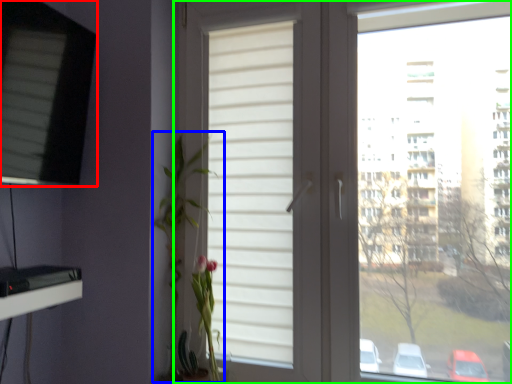
Question: Estimate the real-world distances between objects in this image. Which object is closer to window (highlighted by a red box), floral arrangement (highlighted by a blue box) or window (highlighted by a green box)?

Choices:
 (A) floral arrangement
 (B) window

Answer: (A)